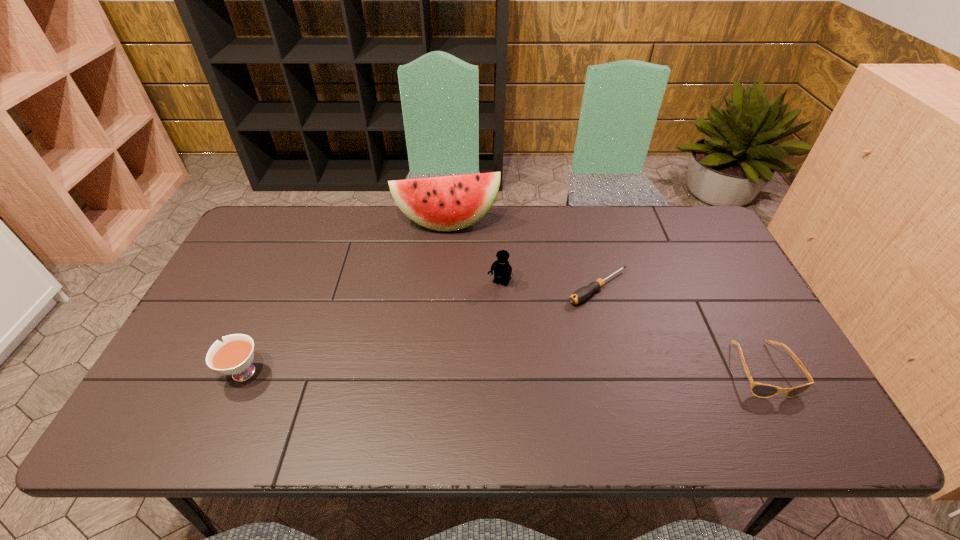
This screenshot has width=960, height=540. I want to click on free space at the far left corner of the desktop, so click(x=254, y=242).

Identify the location of vacant area that lies between the watermelon and the leftmost object. The height and width of the screenshot is (540, 960). (344, 298).

Where is `vacant space in between the Lego and the shortest object`? Image resolution: width=960 pixels, height=540 pixels. vacant space in between the Lego and the shortest object is located at coordinates (549, 286).

Find the location of `vacant space that is in between the farthest object and the leftmost object`. vacant space that is in between the farthest object and the leftmost object is located at coordinates (344, 298).

The width and height of the screenshot is (960, 540). I want to click on empty location between the shortest object and the leftmost object, so click(x=420, y=330).

Identify the location of free space that is in between the shortest object and the teacup. This screenshot has width=960, height=540. (420, 330).

At what (x,y) coordinates should I click in order to perform the action: click on empty space that is in between the shortest object and the teacup. Please return your answer as a coordinate pair (x, y). The width and height of the screenshot is (960, 540). Looking at the image, I should click on (420, 330).

The height and width of the screenshot is (540, 960). Find the location of `free space between the sunglasses and the farthest object`. free space between the sunglasses and the farthest object is located at coordinates (604, 296).

Identify the location of vacant point located between the farthest object and the teacup. This screenshot has height=540, width=960. (344, 298).

Locate an element on the screen. The width and height of the screenshot is (960, 540). free space between the leftmost object and the screwdriver is located at coordinates (420, 330).